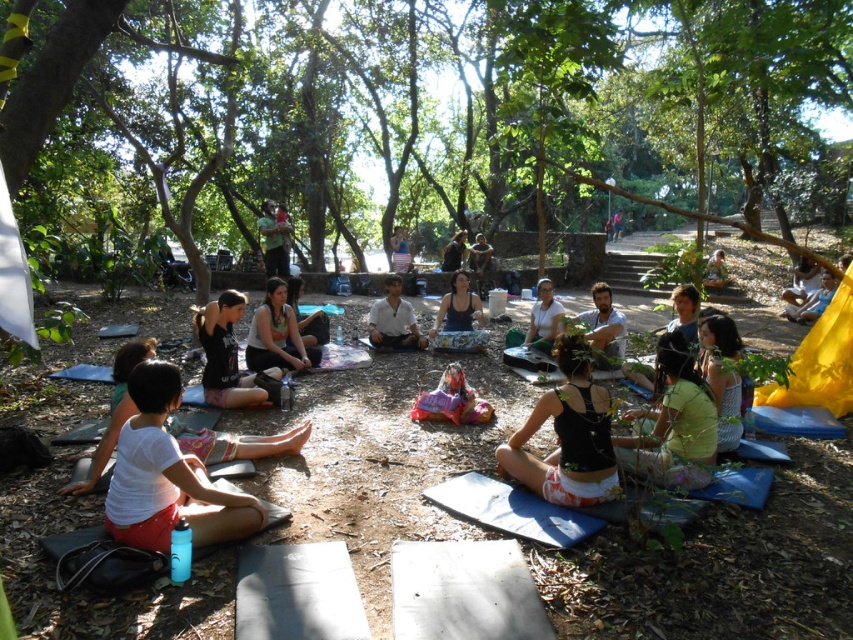
You are a photographer trying to capture a clear shot of both the matte black tank top at center and the white cotton shirt at center. Since you want to ensure both are visible in the photo, which clothing item should you focus on first to make sure it doesn t get cropped out?

The matte black tank top at center is bigger than the white cotton shirt at center, so you should focus on the matte black tank top at center first to ensure it fits within the frame since it takes up more space.

You are a photographer taking a picture of the yoga session. You want to focus on the white fabric shirt at lower left and the knitted light blue sweater at lower right. Which of these two clothing items is closer to the camera?

The white fabric shirt at lower left is closer to the camera because it is in front of the knitted light blue sweater at lower right.

You are a photographer standing at the center of the yoga group. You want to take a photo that includes both the point at coordinates point (210, 508) and point (728, 429). Which point should you focus on first to ensure both are in focus?

You should focus on point (210, 508) first because it is closer to the camera than point (728, 429), ensuring both will be in focus when focusing on the closer point.